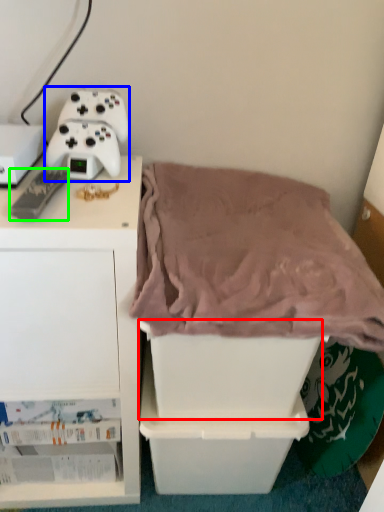
Question: Which object is positioned farthest from storage box (highlighted by a red box)? Select from game controller (highlighted by a blue box) and game controller (highlighted by a green box).

Choices:
 (A) game controller
 (B) game controller

Answer: (B)